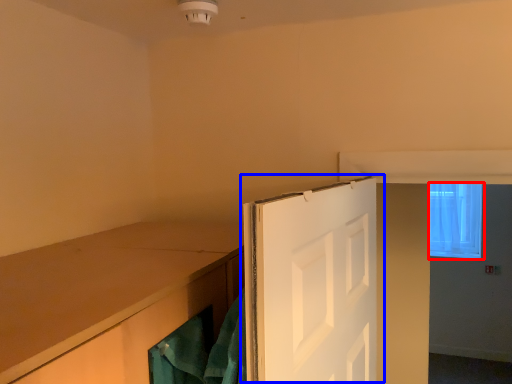
Question: Which object is closer to the camera taking this photo, window (highlighted by a red box) or door (highlighted by a blue box)?

Choices:
 (A) window
 (B) door

Answer: (B)